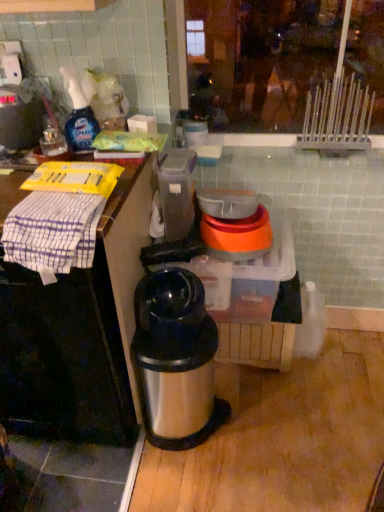
Question: From a real-world perspective, is orange plastic bowl at center, which is the 1th appliance from right to left, positioned above or below white checkered cloth at left?

Choices:
 (A) below
 (B) above

Answer: (B)

Question: In terms of width, does orange plastic bowl at center, which is the 1th appliance from right to left, look wider or thinner when compared to white checkered cloth at left?

Choices:
 (A) wide
 (B) thin

Answer: (B)

Question: Which of these objects is positioned closest to the orange plastic bowl at center, which is the 1th appliance from right to left?

Choices:
 (A) translucent plastic container at center, placed as the 2th appliance when sorted from right to left
 (B) stainless steel thermos at center
 (C) brushed metal spray bottle at left
 (D) clear plastic spray bottle at upper left
 (E) white checkered cloth at left

Answer: (A)

Question: Considering the real-world distances, which object is closest to the orange plastic bowl at center, which is the 2th appliance in left-to-right order?

Choices:
 (A) brushed metal spray bottle at left
 (B) stainless steel thermos at center
 (C) translucent plastic container at center, which appears as the 1th appliance when viewed from the left
 (D) white checkered cloth at left
 (E) white checkered cloth at left

Answer: (C)